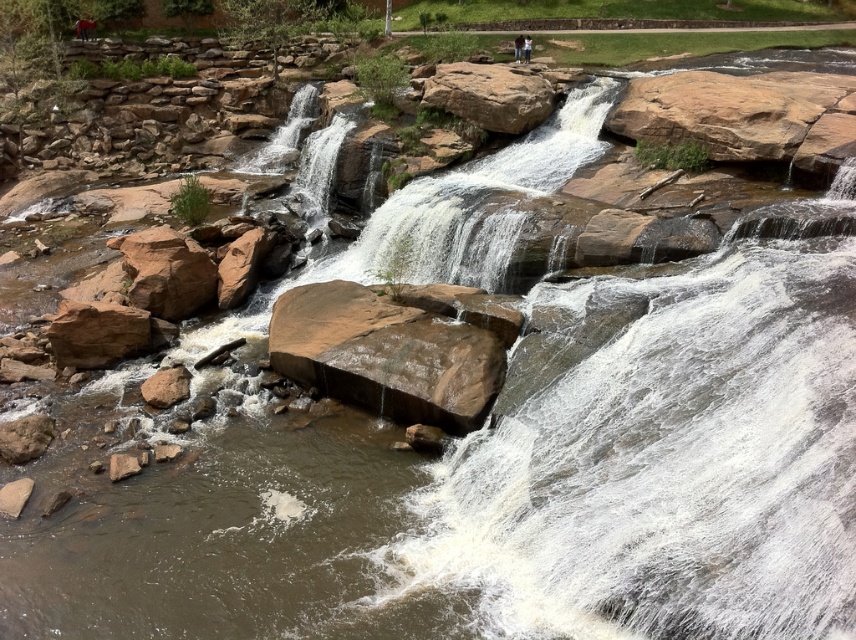
Who is positioned more to the right, smooth rock waterfall at center or brown rough rock at lower left?

Positioned to the right is smooth rock waterfall at center.

Who is more forward, (779, 456) or (149, 394)?

Point (779, 456) is in front.

Identify the location of smooth rock waterfall at center. (651, 465).

Is brown rough rock at upper center bigger than dark blue jeans at center?

Correct, brown rough rock at upper center is larger in size than dark blue jeans at center.

Which is above, brown rough rock at upper center or dark blue jeans at center?

dark blue jeans at center is above.

Locate an element on the screen. The width and height of the screenshot is (856, 640). brown rough rock at upper center is located at coordinates (489, 96).

Between brown rough rock at center and dark blue jeans at center, which one appears on the right side from the viewer's perspective?

Positioned to the right is dark blue jeans at center.

Between point (418, 413) and point (525, 56), which one is positioned in front?

Point (418, 413) is in front.

This screenshot has width=856, height=640. Identify the location of brown rough rock at center. coord(385,355).